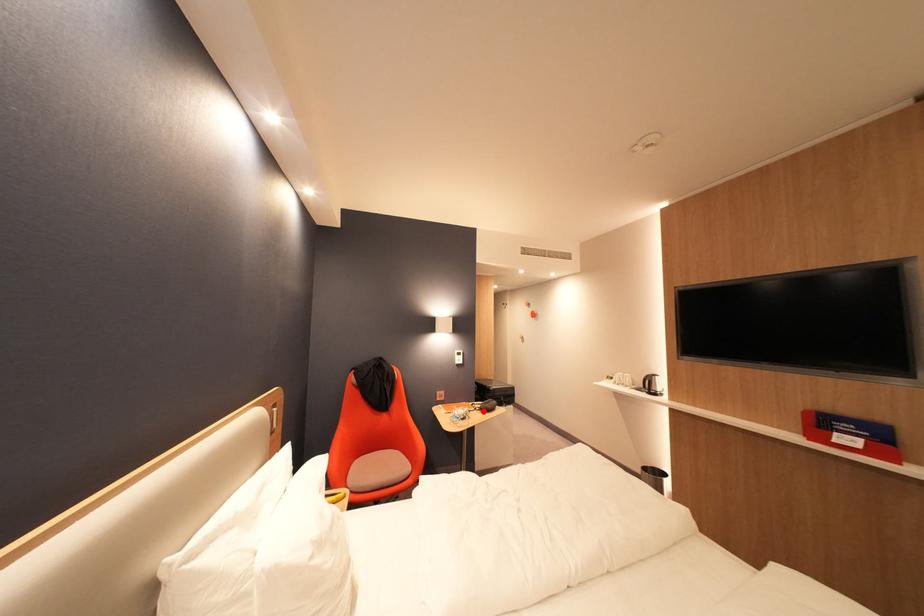
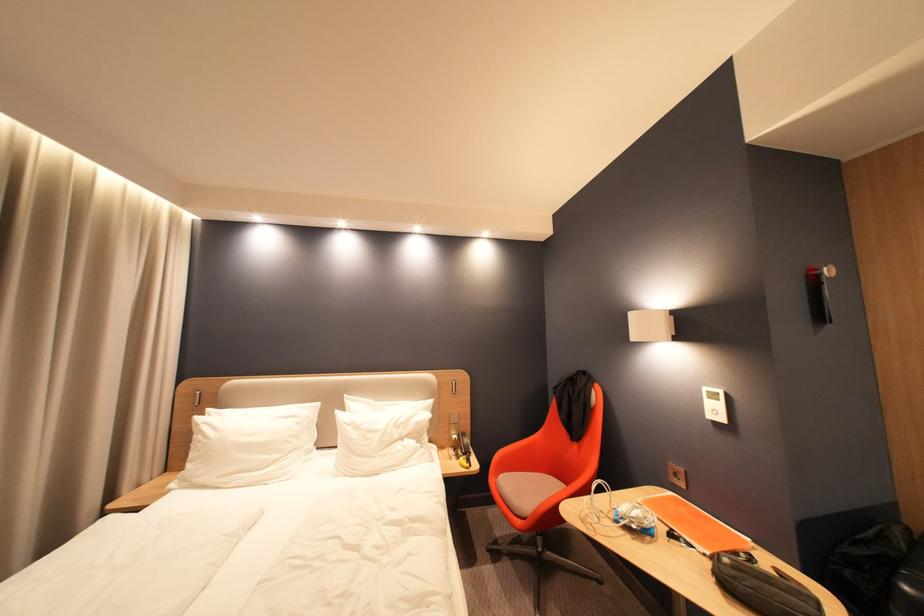
Where in the second image is the point corresponding to the highlighted location from the first image?

(714, 556)